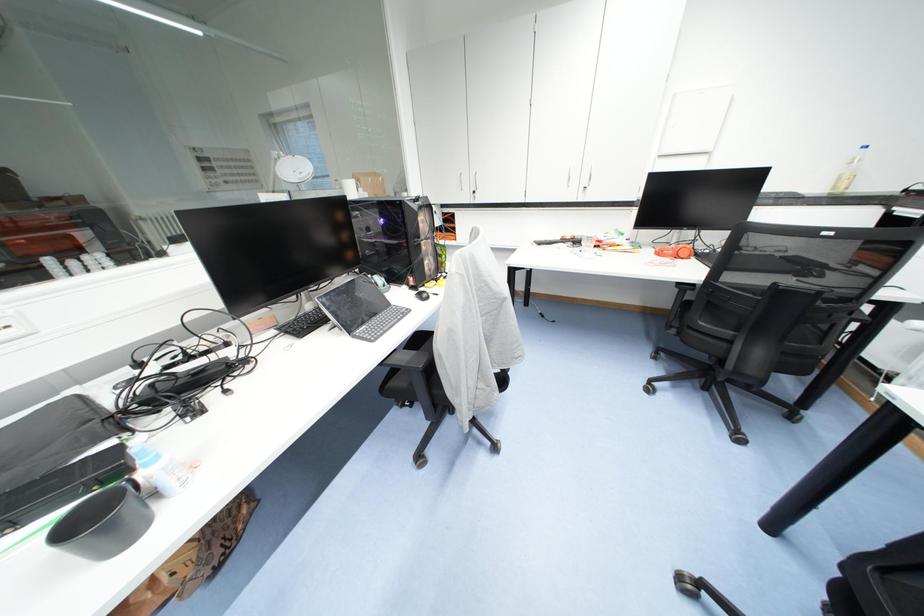
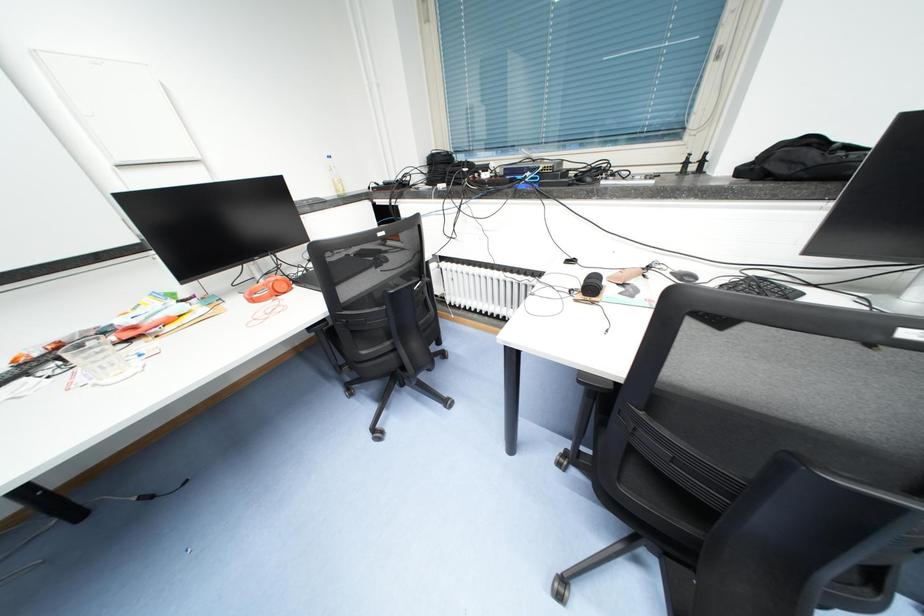
Based on the continuous images, in which direction is the camera rotating?

The camera rotated toward right-down.